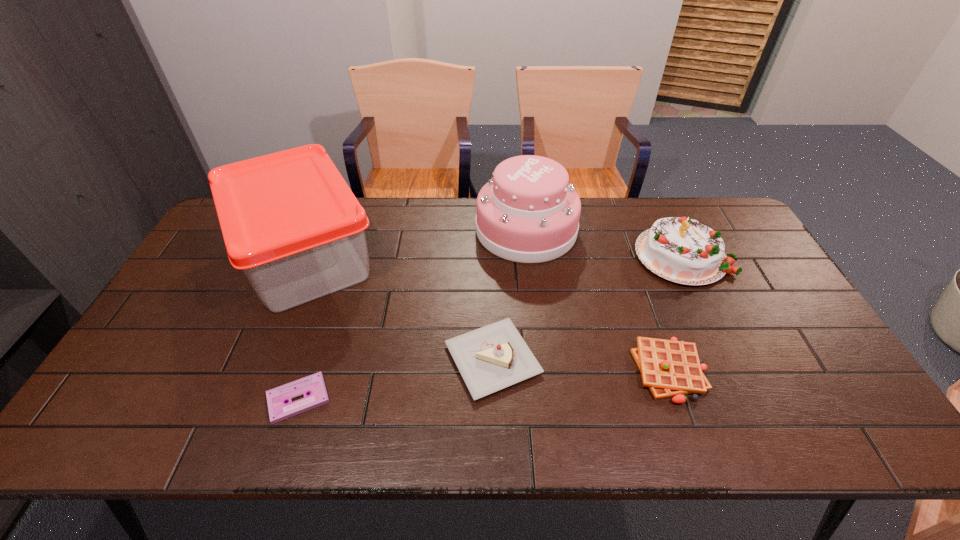
Find the location of a particular element. The height and width of the screenshot is (540, 960). object positioned at the far right corner is located at coordinates (683, 250).

The width and height of the screenshot is (960, 540). Find the location of `free space at the far edge of the desktop`. free space at the far edge of the desktop is located at coordinates (444, 221).

Locate an element on the screen. The width and height of the screenshot is (960, 540). vacant region at the near edge of the desktop is located at coordinates (701, 435).

You are a GUI agent. You are given a task and a screenshot of the screen. Output one action in this format:
    pyautogui.click(x=<x>, y=<y>)
    Task: Click on the vacant space at the left edge
    
    Given the screenshot: What is the action you would take?
    pyautogui.click(x=202, y=321)

The width and height of the screenshot is (960, 540). Identify the location of vacant space at the right edge. point(748,322).

Locate an element on the screen. Image resolution: width=960 pixels, height=540 pixels. vacant space at the far right corner is located at coordinates (723, 201).

Locate an element on the screen. vacant area between the tallest cake and the rightmost cake is located at coordinates (604, 243).

The image size is (960, 540). Identify the location of free point between the fifth tallest object and the shortest cake. (582, 365).

Identify the location of vacant area that lies between the waffle and the tray. (488, 314).

Image resolution: width=960 pixels, height=540 pixels. Identify the location of free point between the second shortest cake and the second shortest object. pyautogui.click(x=676, y=313).